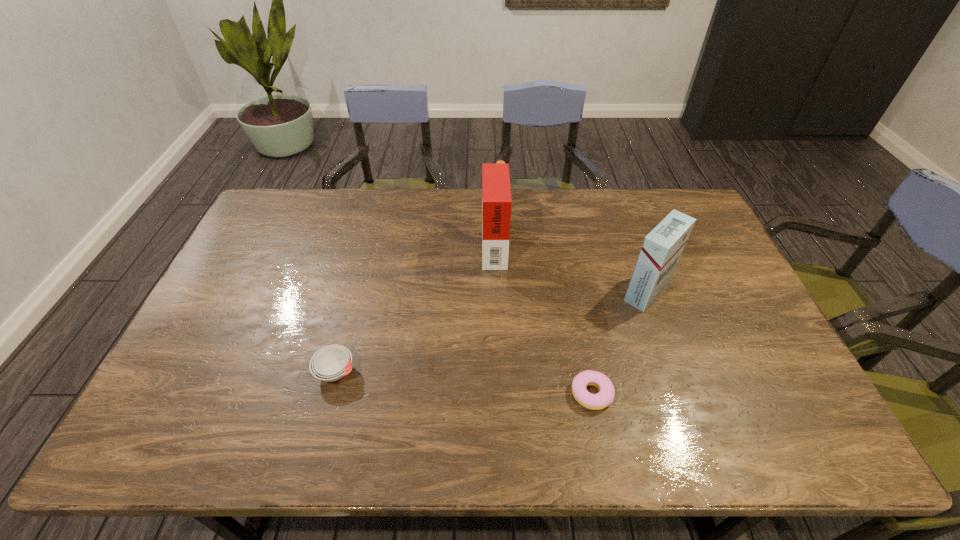
Find the location of a particular element. the farther cigarette case is located at coordinates (496, 194).

I want to click on the farthest object, so click(496, 194).

This screenshot has height=540, width=960. I want to click on the right cigarette case, so click(661, 249).

At what (x,y) coordinates should I click in order to perform the action: click on the nearer cigarette case. Please return your answer as a coordinate pair (x, y). This screenshot has width=960, height=540. Looking at the image, I should click on (661, 249).

You are a GUI agent. You are given a task and a screenshot of the screen. Output one action in this format:
    pyautogui.click(x=<x>, y=<y>)
    Task: Click on the third tallest object
    The width and height of the screenshot is (960, 540).
    Given the screenshot: What is the action you would take?
    pyautogui.click(x=330, y=363)

Locate an element on the screen. This screenshot has height=540, width=960. the leftmost object is located at coordinates (330, 363).

Identify the location of the shortest object. Image resolution: width=960 pixels, height=540 pixels. (605, 396).

Locate an element on the screen. the second object from right to left is located at coordinates (605, 396).

Locate an element on the screen. The height and width of the screenshot is (540, 960). free space located 0.280m on the front-facing side of the farther cigarette case is located at coordinates (397, 244).

What are the coordinates of `free space located 0.090m on the front-facing side of the farther cigarette case` in the screenshot? It's located at (455, 244).